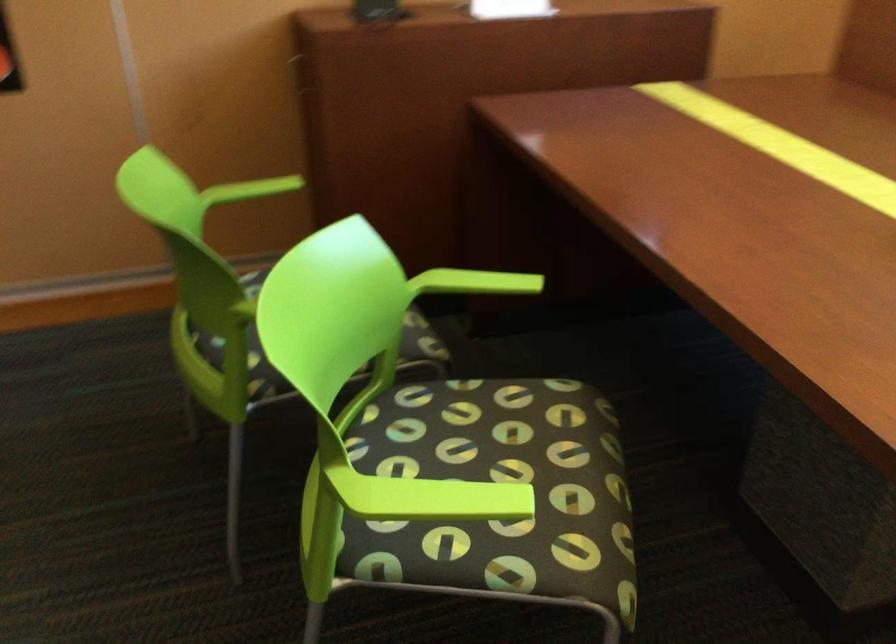
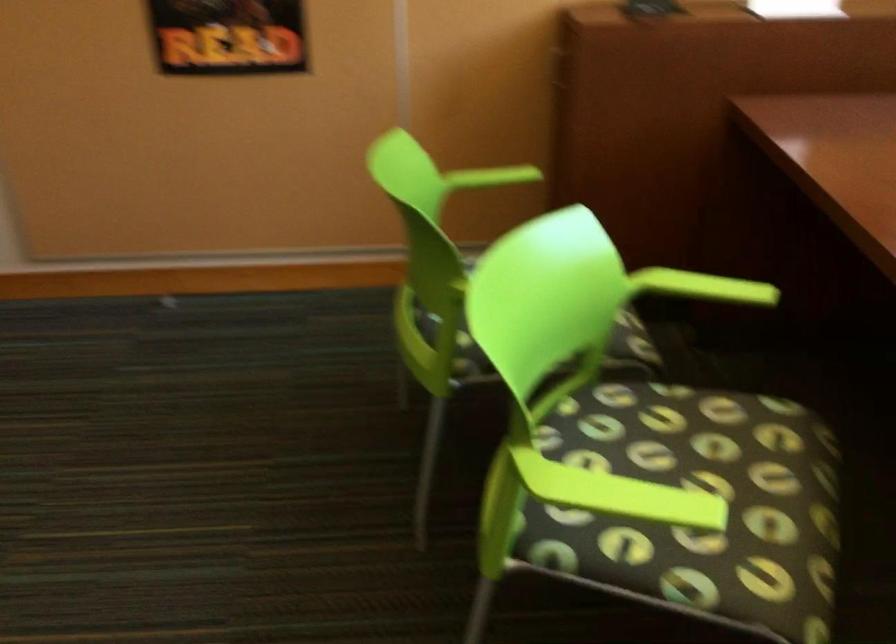
Find the pixel in the second image that matches [446,491] in the first image.

(619, 494)